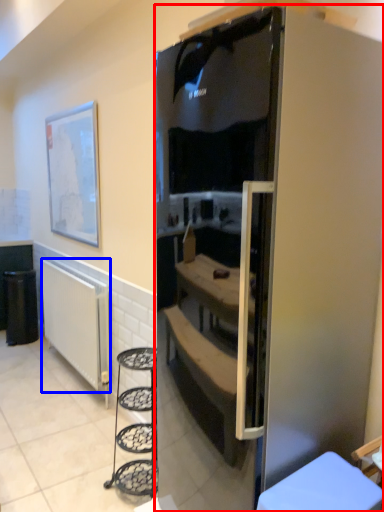
Question: Which object is closer to the camera taking this photo, refrigerator (highlighted by a red box) or radiator (highlighted by a blue box)?

Choices:
 (A) refrigerator
 (B) radiator

Answer: (A)